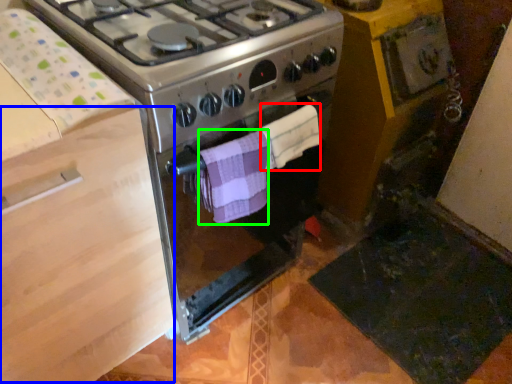
Question: Which object is positioned closest to towel/napkin (highlighted by a red box)? Select from drawer (highlighted by a blue box) and towel/napkin (highlighted by a green box).

Choices:
 (A) drawer
 (B) towel/napkin

Answer: (B)